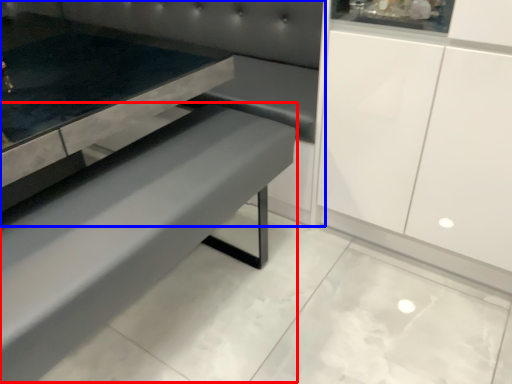
Question: Which object appears closest to the camera in this image, park bench (highlighted by a red box) or couch (highlighted by a blue box)?

Choices:
 (A) park bench
 (B) couch

Answer: (A)